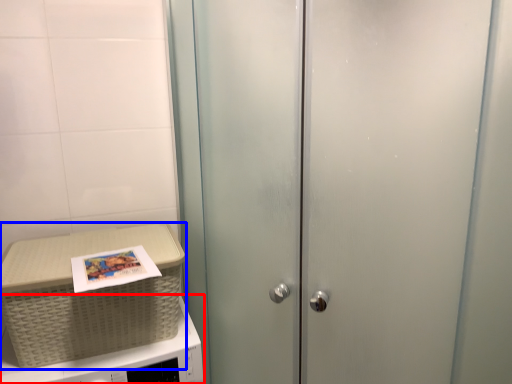
Question: Which of the following is the closest to the observer, microwave oven (highlighted by a red box) or picnic basket (highlighted by a blue box)?

Choices:
 (A) microwave oven
 (B) picnic basket

Answer: (A)